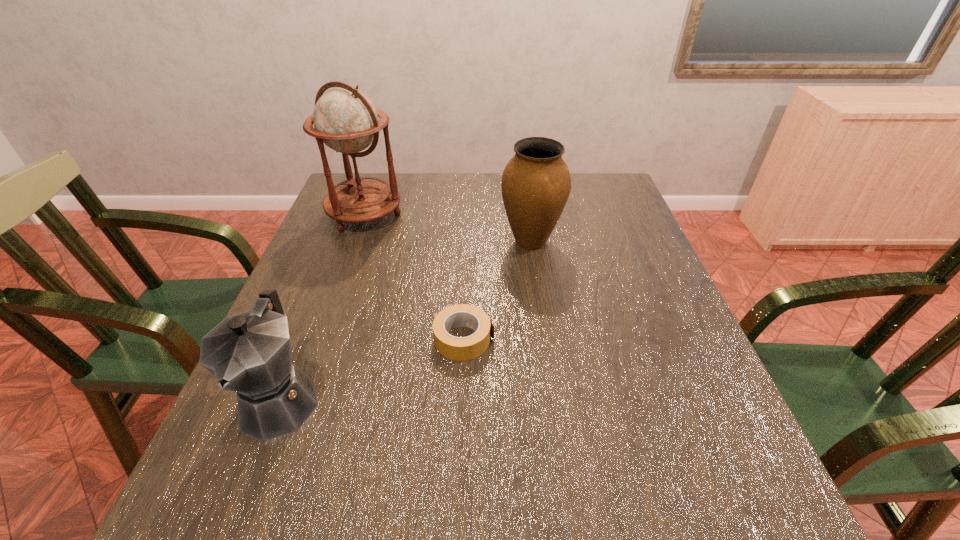
This screenshot has height=540, width=960. Find the location of `empty space between the coffeepot and the third shortest object`. empty space between the coffeepot and the third shortest object is located at coordinates (406, 321).

Locate an element on the screen. empty space between the third shortest object and the tallest object is located at coordinates (447, 228).

In order to click on free space between the second object from right to left and the tallest object in this screenshot , I will do `click(415, 277)`.

Identify the location of free space between the third tallest object and the second object from right to left. This screenshot has width=960, height=540. (372, 369).

Find the location of a particular element. The image size is (960, 540). vacant space that is in between the coffeepot and the urn is located at coordinates (406, 321).

Find the location of `free space that is in between the second object from right to left and the tallest object`. free space that is in between the second object from right to left and the tallest object is located at coordinates (415, 277).

What are the coordinates of `free space that is in between the third object from left to right and the coffeepot` in the screenshot? It's located at (372, 369).

At what (x,y) coordinates should I click in order to perform the action: click on free area in between the coffeepot and the rightmost object. Please return your answer as a coordinate pair (x, y). Image resolution: width=960 pixels, height=540 pixels. Looking at the image, I should click on (406, 321).

This screenshot has height=540, width=960. Find the location of `free point between the third object from left to right and the coffeepot`. free point between the third object from left to right and the coffeepot is located at coordinates (372, 369).

Where is `unoccupied area between the duct tape and the second tallest object`? The image size is (960, 540). unoccupied area between the duct tape and the second tallest object is located at coordinates (497, 291).